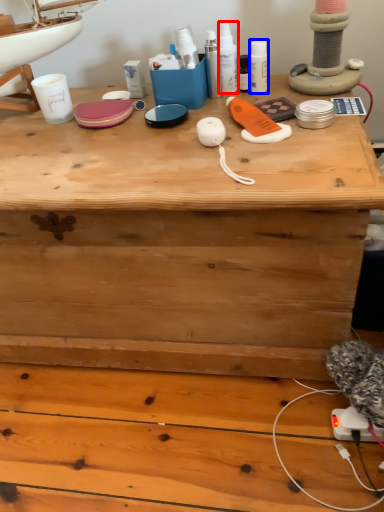
Question: Among these objects, which one is farthest to the camera, toiletry (highlighted by a red box) or toiletry (highlighted by a blue box)?

Choices:
 (A) toiletry
 (B) toiletry

Answer: (B)